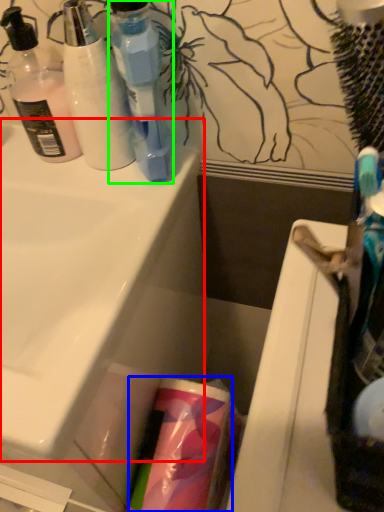
Question: Estimate the real-world distances between objects in this image. Which object is farther from sink (highlighted by a red box), cleaning product (highlighted by a blue box) or bottle (highlighted by a green box)?

Choices:
 (A) cleaning product
 (B) bottle

Answer: (A)